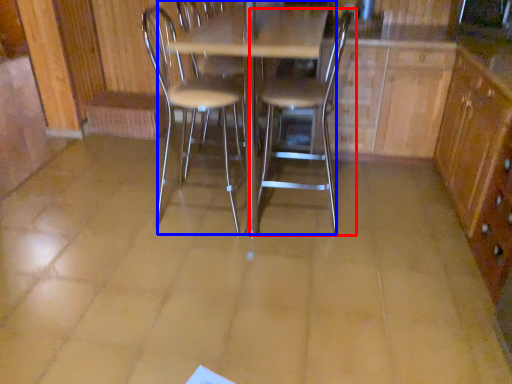
Question: Which of the following is the farthest to the observer, chair (highlighted by a red box) or table (highlighted by a blue box)?

Choices:
 (A) chair
 (B) table

Answer: (A)